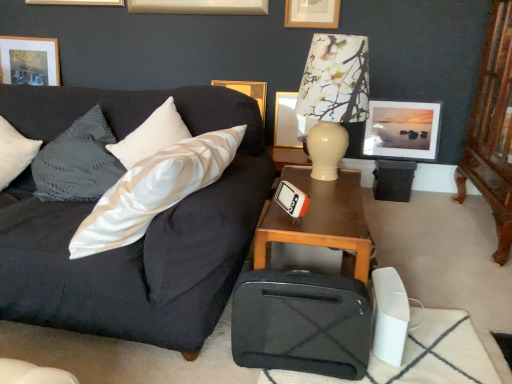
The image size is (512, 384). In order to click on vacant location below matte cream lampshade at upper right (from a real-world perspective) in this screenshot , I will do `click(321, 186)`.